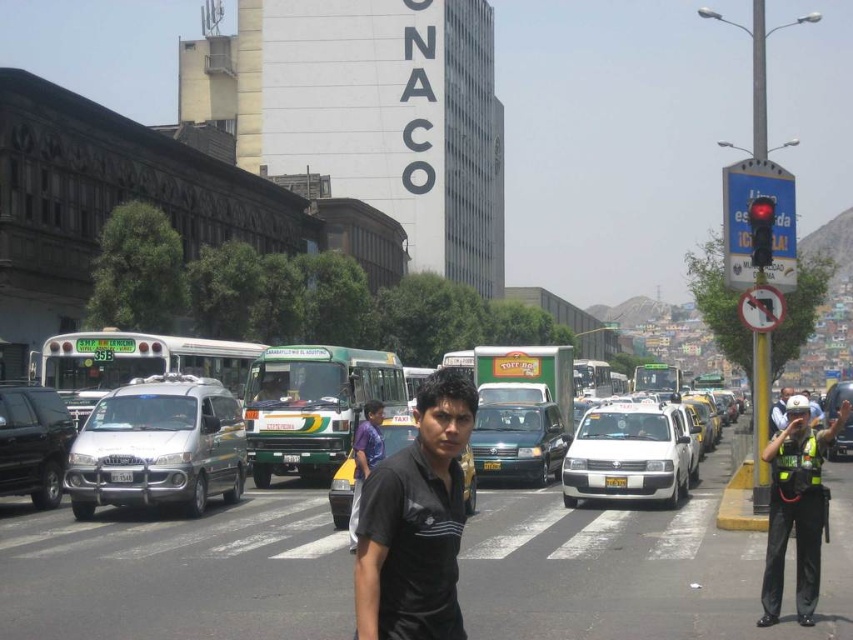
You are a pedestrian standing at the crosswalk in the middle of the street. You see a silver metallic van at center and a metallic silver sedan at center. Which vehicle is closer to you?

The silver metallic van at center is closer to you because it is in front of the metallic silver sedan at center.

You are standing at the intersection and want to know which of the two points, point (33, 397) or point (770, 205), is closer to you. Based on the scene description, can you determine this?

Point (33, 397) is closer to you than point (770, 205) because it is further to the viewer.